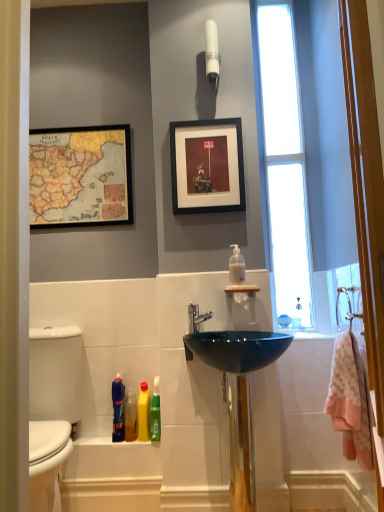
Question: Does translucent plastic bottle at lower center, the fourth cleaning product in the right-to-left sequence, have a lesser height compared to transparent glass window at upper right?

Choices:
 (A) no
 (B) yes

Answer: (B)

Question: Considering the relative positions of translucent plastic bottle at lower center, the fourth cleaning product in the right-to-left sequence, and transparent glass window at upper right in the image provided, is translucent plastic bottle at lower center, the fourth cleaning product in the right-to-left sequence, behind transparent glass window at upper right?

Choices:
 (A) yes
 (B) no

Answer: (B)

Question: Considering the relative sizes of translucent plastic bottle at lower center, acting as the 2th cleaning product starting from the left, and transparent glass window at upper right in the image provided, is translucent plastic bottle at lower center, acting as the 2th cleaning product starting from the left, wider than transparent glass window at upper right?

Choices:
 (A) no
 (B) yes

Answer: (B)

Question: Considering the relative sizes of translucent plastic bottle at lower center, the fourth cleaning product in the right-to-left sequence, and transparent glass window at upper right in the image provided, is translucent plastic bottle at lower center, the fourth cleaning product in the right-to-left sequence, taller than transparent glass window at upper right?

Choices:
 (A) yes
 (B) no

Answer: (B)

Question: Can you confirm if translucent plastic bottle at lower center, the fourth cleaning product in the right-to-left sequence, is positioned to the left of transparent glass window at upper right?

Choices:
 (A) no
 (B) yes

Answer: (B)

Question: Considering the relative positions of translucent plastic bottle at lower center, acting as the 2th cleaning product starting from the left, and transparent glass window at upper right in the image provided, is translucent plastic bottle at lower center, acting as the 2th cleaning product starting from the left, in front of transparent glass window at upper right?

Choices:
 (A) yes
 (B) no

Answer: (A)

Question: Is transparent glass window at upper right taller than white glossy light fixture at upper center?

Choices:
 (A) no
 (B) yes

Answer: (B)

Question: Can you confirm if transparent glass window at upper right is positioned to the left of white glossy light fixture at upper center?

Choices:
 (A) yes
 (B) no

Answer: (B)

Question: Is white glossy light fixture at upper center surrounded by transparent glass window at upper right?

Choices:
 (A) yes
 (B) no

Answer: (B)

Question: Is white glossy light fixture at upper center at the back of transparent glass window at upper right?

Choices:
 (A) no
 (B) yes

Answer: (A)

Question: Would you say transparent glass window at upper right is outside white glossy light fixture at upper center?

Choices:
 (A) no
 (B) yes

Answer: (B)

Question: From a real-world perspective, does transparent glass window at upper right stand above white glossy light fixture at upper center?

Choices:
 (A) no
 (B) yes

Answer: (A)

Question: Considering the relative sizes of translucent plastic soap dispenser at upper center, marked as the 1th cleaning product in a right-to-left arrangement, and pink cotton bath towel at right in the image provided, is translucent plastic soap dispenser at upper center, marked as the 1th cleaning product in a right-to-left arrangement, wider than pink cotton bath towel at right?

Choices:
 (A) no
 (B) yes

Answer: (A)